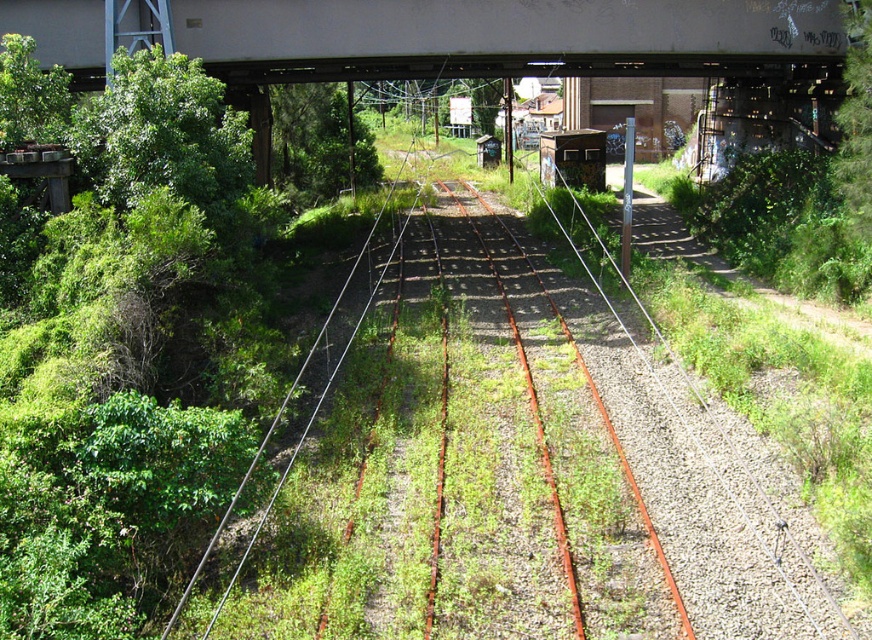
You are a railway inspector evaluating the disused tracks. You notice a point marked at coordinates (501, 36). What object is located at this coordinate?

The point at coordinates (501, 36) marks the white painted steel bridge at upper center.

You are standing at the edge of the disused railway track and see the white painted steel bridge at upper center and the green leafy tree at left. Which object is positioned more to the east if the bridge is to the right of the tree?

The white painted steel bridge at upper center is positioned more to the east because it is to the right of the green leafy tree at left, and in the image, right corresponds to east.